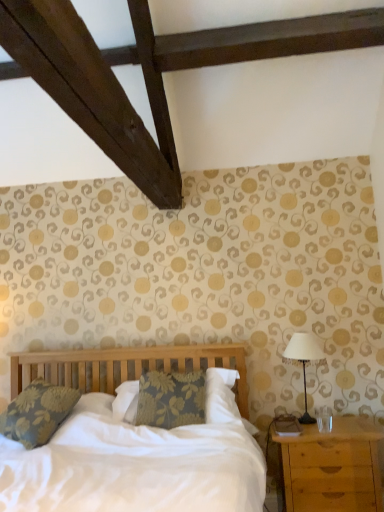
Question: Does floral fabric pillow at left have a smaller size compared to light brown wooden nightstand at lower right?

Choices:
 (A) no
 (B) yes

Answer: (B)

Question: Does floral fabric pillow at left have a lesser height compared to light brown wooden nightstand at lower right?

Choices:
 (A) no
 (B) yes

Answer: (B)

Question: From the image's perspective, does floral fabric pillow at left appear lower than light brown wooden nightstand at lower right?

Choices:
 (A) no
 (B) yes

Answer: (A)

Question: Does floral fabric pillow at left have a lesser width compared to light brown wooden nightstand at lower right?

Choices:
 (A) no
 (B) yes

Answer: (A)

Question: Does floral fabric pillow at left appear on the right side of light brown wooden nightstand at lower right?

Choices:
 (A) yes
 (B) no

Answer: (B)

Question: From the image's perspective, relative to metallic silver table lamp at right, is floral fabric pillow at left above or below?

Choices:
 (A) below
 (B) above

Answer: (A)

Question: Visually, is floral fabric pillow at left positioned to the left or to the right of metallic silver table lamp at right?

Choices:
 (A) left
 (B) right

Answer: (A)

Question: Is floral fabric pillow at left wider or thinner than metallic silver table lamp at right?

Choices:
 (A) wide
 (B) thin

Answer: (A)

Question: From their relative heights in the image, would you say floral fabric pillow at left is taller or shorter than metallic silver table lamp at right?

Choices:
 (A) short
 (B) tall

Answer: (A)

Question: In terms of width, does metallic silver table lamp at right look wider or thinner when compared to light brown wooden nightstand at lower right?

Choices:
 (A) thin
 (B) wide

Answer: (A)

Question: Is metallic silver table lamp at right inside the boundaries of light brown wooden nightstand at lower right, or outside?

Choices:
 (A) outside
 (B) inside

Answer: (A)

Question: Looking at the image, does metallic silver table lamp at right seem bigger or smaller compared to light brown wooden nightstand at lower right?

Choices:
 (A) small
 (B) big

Answer: (A)

Question: From their relative heights in the image, would you say metallic silver table lamp at right is taller or shorter than light brown wooden nightstand at lower right?

Choices:
 (A) short
 (B) tall

Answer: (A)

Question: From a real-world perspective, is floral fabric pillow at left physically located above or below light brown wooden nightstand at lower right?

Choices:
 (A) above
 (B) below

Answer: (A)

Question: Visually, is floral fabric pillow at left positioned to the left or to the right of light brown wooden nightstand at lower right?

Choices:
 (A) left
 (B) right

Answer: (A)